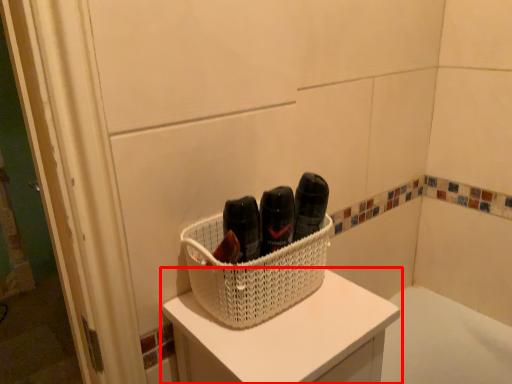
Question: From the image's perspective, considering the relative positions of furniture (annotated by the red box) and basket in the image provided, where is furniture (annotated by the red box) located with respect to the staircase?

Choices:
 (A) above
 (B) below

Answer: (B)